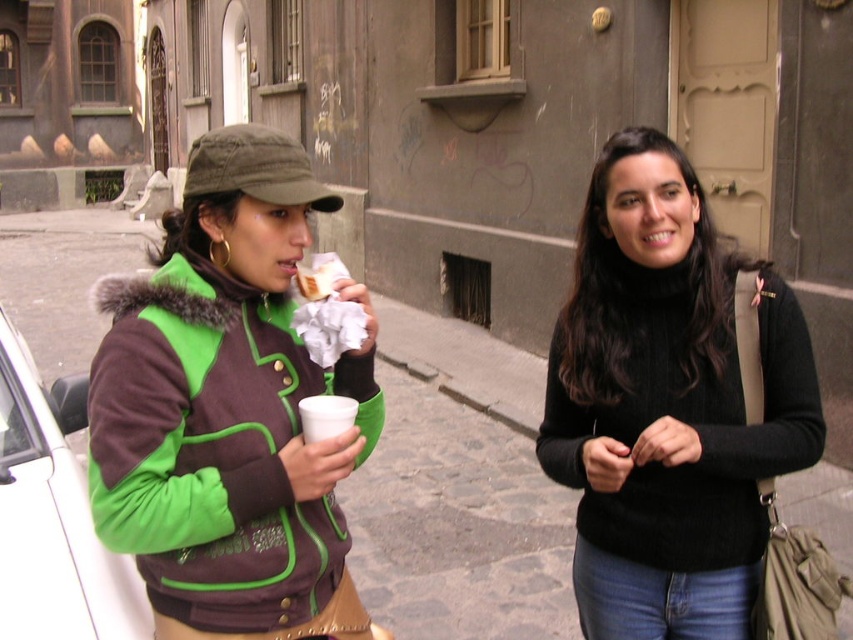
Can you confirm if green fuzzy jacket at left is shorter than white paper cup at center?

Yes.

Which is more to the right, green fuzzy jacket at left or white paper cup at center?

green fuzzy jacket at left

Who is more forward, (247, 632) or (316, 296)?

Positioned in front is point (247, 632).

Locate an element on the screen. This screenshot has width=853, height=640. green fuzzy jacket at left is located at coordinates (213, 451).

Looking at this image, measure the distance between point (x=717, y=470) and camera.

The distance of point (x=717, y=470) from camera is 1.63 meters.

Is black knit sweater at center taller than green fuzzy jacket at left?

Indeed, black knit sweater at center has a greater height compared to green fuzzy jacket at left.

At what (x,y) coordinates should I click in order to perform the action: click on black knit sweater at center. Please return your answer as a coordinate pair (x, y). This screenshot has width=853, height=640. Looking at the image, I should click on (668, 404).

This screenshot has height=640, width=853. Find the location of `black knit sweater at center`. black knit sweater at center is located at coordinates (668, 404).

Does point (24, 608) come farther from viewer compared to point (321, 420)?

Yes, it is behind point (321, 420).

Can you confirm if white matte car at left is positioned above white matte cup at center?

Actually, white matte car at left is below white matte cup at center.

Describe the element at coordinates (53, 516) in the screenshot. I see `white matte car at left` at that location.

Where is `white matte car at left`? white matte car at left is located at coordinates pyautogui.click(x=53, y=516).